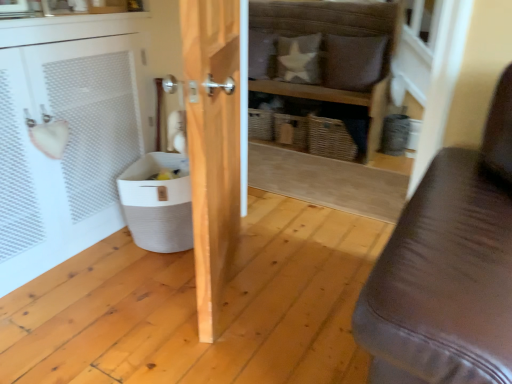
This screenshot has width=512, height=384. Describe the element at coordinates (353, 62) in the screenshot. I see `brown leather pillow at upper center, acting as the second pillow starting from the left` at that location.

This screenshot has height=384, width=512. I want to click on wooden shelf at center, so click(x=330, y=59).

What are the coordinates of `wooden door at center` in the screenshot? It's located at 215,142.

What do you see at coordinates (157, 203) in the screenshot?
I see `white woven laundry basket at lower left` at bounding box center [157, 203].

Where is `white mesh cabinet at left`? This screenshot has width=512, height=384. white mesh cabinet at left is located at coordinates (70, 134).

Is white mesh cabinet at left beside brown leather pillow at upper center, the first pillow from the right?

No, white mesh cabinet at left is not making contact with brown leather pillow at upper center, the first pillow from the right.

From the image's perspective, does white mesh cabinet at left appear higher than brown leather pillow at upper center, the first pillow from the right?

No.

Can you tell me how much white mesh cabinet at left and brown leather pillow at upper center, acting as the second pillow starting from the left, differ in facing direction?

Result: The angular difference between white mesh cabinet at left and brown leather pillow at upper center, acting as the second pillow starting from the left, is 91.8 degrees.

Is white fabric pillow at upper center, the second pillow when ordered from right to left, spatially inside white mesh cabinet at left, or outside of it?

white fabric pillow at upper center, the second pillow when ordered from right to left, is not enclosed by white mesh cabinet at left.

From their relative heights in the image, would you say white fabric pillow at upper center, the 1th pillow in the left-to-right sequence, is taller or shorter than white mesh cabinet at left?

Clearly, white fabric pillow at upper center, the 1th pillow in the left-to-right sequence, is shorter compared to white mesh cabinet at left.

Is white fabric pillow at upper center, the second pillow when ordered from right to left, placed right next to white mesh cabinet at left?

white fabric pillow at upper center, the second pillow when ordered from right to left, and white mesh cabinet at left are not in contact.

Which pillow is the 1st one when counting from the right side of the white mesh cabinet at left? Please provide its 2D coordinates.

[(298, 59)]

From the image's perspective, is wooden door at center on top of brown leather pillow at upper center, the first pillow from the right?

Incorrect, from the image's perspective, wooden door at center is lower than brown leather pillow at upper center, the first pillow from the right.

Considering the sizes of objects wooden door at center and brown leather pillow at upper center, acting as the second pillow starting from the left, in the image provided, who is wider, wooden door at center or brown leather pillow at upper center, acting as the second pillow starting from the left,?

wooden door at center is wider.

Between wooden door at center and brown leather pillow at upper center, the first pillow from the right, which one appears on the left side from the viewer's perspective?

wooden door at center.

From a real-world perspective, which object rests below the other?

In real-world perspective, wooden door at center is lower.

Can you tell me how much wooden door at center and white mesh cabinet at left differ in facing direction?

154 degrees separate the facing orientations of wooden door at center and white mesh cabinet at left.

Is wooden door at center facing away from white mesh cabinet at left?

That's not correct — wooden door at center is not looking away from white mesh cabinet at left.

From a real-world perspective, is wooden door at center located beneath white mesh cabinet at left?

Actually, wooden door at center is physically above white mesh cabinet at left in the real world.

From the image's perspective, is wooden door at center under white mesh cabinet at left?

Yes, from the image's perspective, wooden door at center is below white mesh cabinet at left.

Can you tell me how much wooden door at center and white fabric pillow at upper center, the second pillow when ordered from right to left, differ in facing direction?

The angle between the facing direction of wooden door at center and the facing direction of white fabric pillow at upper center, the second pillow when ordered from right to left, is 65.7 degrees.

The image size is (512, 384). Identify the location of door that is below the white fabric pillow at upper center, the 1th pillow in the left-to-right sequence (from the image's perspective). (215, 142).

Is wooden door at center behind white fabric pillow at upper center, the second pillow when ordered from right to left?

No, wooden door at center is closer to the viewer.

Is wooden door at center not within white fabric pillow at upper center, the second pillow when ordered from right to left?

Yes, wooden door at center is located beyond the bounds of white fabric pillow at upper center, the second pillow when ordered from right to left.

Considering the relative positions of brown leather pillow at upper center, the first pillow from the right, and white mesh cabinet at left in the image provided, is brown leather pillow at upper center, the first pillow from the right, to the left of white mesh cabinet at left from the viewer's perspective?

No, brown leather pillow at upper center, the first pillow from the right, is not to the left of white mesh cabinet at left.

Is point (347, 87) positioned after point (131, 69)?

Yes, it is.

Could you measure the distance between brown leather pillow at upper center, the first pillow from the right, and white mesh cabinet at left?

brown leather pillow at upper center, the first pillow from the right, and white mesh cabinet at left are 1.77 meters apart.

Measure the distance between wooden shelf at center and wooden door at center.

A distance of 1.50 meters exists between wooden shelf at center and wooden door at center.

Between wooden shelf at center and wooden door at center, which one has larger width?

Wider between the two is wooden shelf at center.

Looking at this image, is wooden shelf at center positioned with its back to wooden door at center?

wooden shelf at center does not have its back to wooden door at center.

From the image's perspective, which pillow is the 1st one above the white mesh cabinet at left? Please provide its 2D coordinates.

[(353, 62)]

From a real-world perspective, which pillow is the 1st one above the white mesh cabinet at left? Please provide its 2D coordinates.

[(298, 59)]

Based on their spatial positions, is white woven laundry basket at lower left or wooden shelf at center further from white mesh cabinet at left?

wooden shelf at center.

Considering their positions, is white fabric pillow at upper center, the second pillow when ordered from right to left, positioned closer to white woven laundry basket at lower left than wooden shelf at center?

Among the two, wooden shelf at center is located nearer to white woven laundry basket at lower left.

In the scene shown: Based on their spatial positions, is white woven laundry basket at lower left or white mesh cabinet at left closer to brown leather pillow at upper center, the first pillow from the right?

white woven laundry basket at lower left.

Based on their spatial positions, is white mesh cabinet at left or wooden shelf at center closer to brown leather pillow at upper center, acting as the second pillow starting from the left?

The object closer to brown leather pillow at upper center, acting as the second pillow starting from the left, is wooden shelf at center.

Based on their spatial positions, is wooden shelf at center or wooden door at center further from white fabric pillow at upper center, the second pillow when ordered from right to left?

Among the two, wooden door at center is located further to white fabric pillow at upper center, the second pillow when ordered from right to left.

Estimate the real-world distances between objects in this image. Which object is closer to white mesh cabinet at left, brown leather pillow at upper center, acting as the second pillow starting from the left, or white fabric pillow at upper center, the second pillow when ordered from right to left?

brown leather pillow at upper center, acting as the second pillow starting from the left, lies closer to white mesh cabinet at left than the other object.

Estimate the real-world distances between objects in this image. Which object is closer to white fabric pillow at upper center, the 1th pillow in the left-to-right sequence, white woven laundry basket at lower left or wooden door at center?

white woven laundry basket at lower left.

Looking at the image, which one is located further to white fabric pillow at upper center, the 1th pillow in the left-to-right sequence, brown leather pillow at upper center, the first pillow from the right, or white mesh cabinet at left?

white mesh cabinet at left is positioned further to the anchor white fabric pillow at upper center, the 1th pillow in the left-to-right sequence.

The height and width of the screenshot is (384, 512). Identify the location of laundry basket between white mesh cabinet at left and wooden shelf at center. (157, 203).

The image size is (512, 384). What are the coordinates of `shelf between wooden door at center and brown leather pillow at upper center, acting as the second pillow starting from the left, in the front-back direction` in the screenshot? It's located at (330, 59).

Where is `pillow between white mesh cabinet at left and white fabric pillow at upper center, the second pillow when ordered from right to left, along the z-axis`? This screenshot has width=512, height=384. pillow between white mesh cabinet at left and white fabric pillow at upper center, the second pillow when ordered from right to left, along the z-axis is located at coordinates (353, 62).

Image resolution: width=512 pixels, height=384 pixels. Find the location of `pillow between wooden door at center and white fabric pillow at upper center, the second pillow when ordered from right to left, along the z-axis`. pillow between wooden door at center and white fabric pillow at upper center, the second pillow when ordered from right to left, along the z-axis is located at coordinates (353, 62).